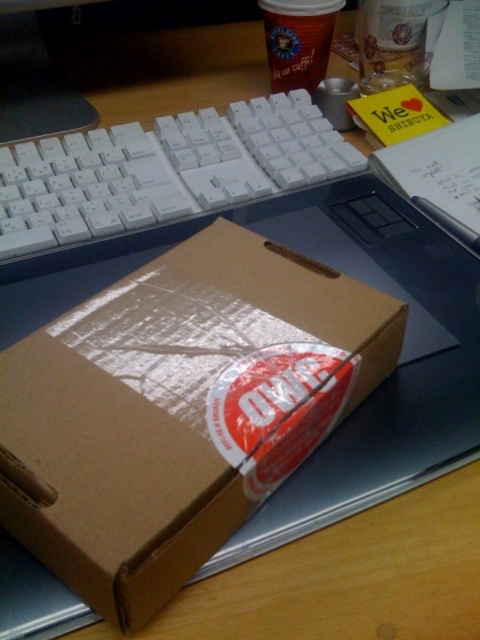
You have a brown cardboard box at center and a white plastic keyboard at center on your desk. You need to place a new item that is 15 cm wide. Which object can you place it next to without exceeding the space?

The brown cardboard box at center has a width less than the white plastic keyboard at center, so the new item of 15 cm can be placed next to the white plastic keyboard at center since it has more space available.

You are organizing your desk and need to place a new item between the brown cardboard box at center and the white plastic keyboard at center. The item is 10 inches long. Can it fit in the space between them?

The distance between the brown cardboard box at center and the white plastic keyboard at center is 9.84 inches. Since the item is 10 inches long, it cannot fit in the space between them as it is slightly longer than the available distance.

You need to place both the brown cardboard box at center and the white plastic keyboard at center into a storage bin that can only fit items smaller than the keyboard. Which item can be placed in the bin?

The brown cardboard box at center can be placed in the storage bin because it has a smaller size compared to the white plastic keyboard at center, making it eligible for the bin that requires items smaller than the keyboard.